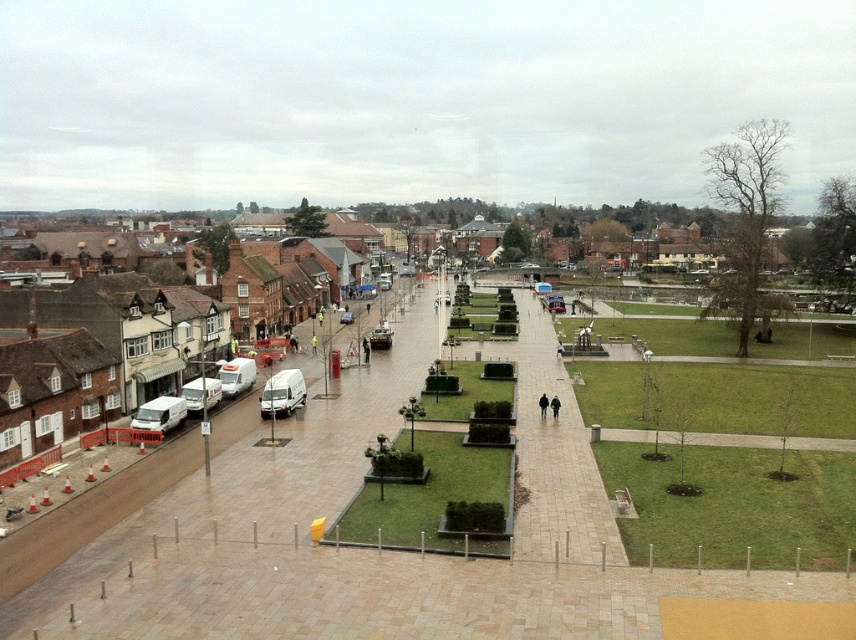
Question: Which is nearer to the black matte jacket at center?

Choices:
 (A) smooth concrete plaza at center
 (B) paved stone pathway at center
 (C) smooth concrete path at center

Answer: (B)

Question: Which point is farther to the camera?

Choices:
 (A) smooth concrete plaza at center
 (B) paved stone pathway at center
 (C) black matte jacket at center
 (D) smooth concrete path at center

Answer: (C)

Question: Where is black matte jacket at center located in relation to dark gray coat at center in the image?

Choices:
 (A) left
 (B) right

Answer: (A)

Question: Which is farther from the dark gray coat at center?

Choices:
 (A) black matte jacket at center
 (B) smooth concrete path at center

Answer: (B)

Question: Can you confirm if smooth concrete plaza at center is thinner than dark gray coat at center?

Choices:
 (A) no
 (B) yes

Answer: (A)

Question: Does paved stone pathway at center appear on the right side of black matte jacket at center?

Choices:
 (A) yes
 (B) no

Answer: (A)